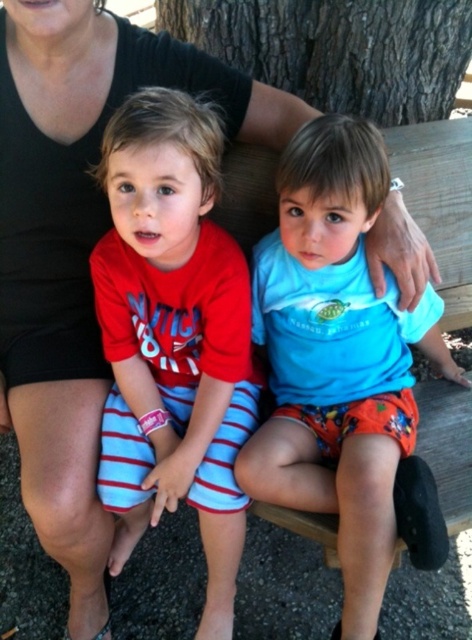
Can you confirm if blue matte shirt at center is positioned to the left of brown rough bark at upper center?

Incorrect, blue matte shirt at center is not on the left side of brown rough bark at upper center.

Can you confirm if blue matte shirt at center is wider than brown rough bark at upper center?

No.

This screenshot has height=640, width=472. In order to click on blue matte shirt at center in this screenshot , I will do `click(337, 356)`.

Is red striped shorts at center wider than blue matte shirt at center?

No.

Image resolution: width=472 pixels, height=640 pixels. Describe the element at coordinates (173, 337) in the screenshot. I see `red striped shorts at center` at that location.

What do you see at coordinates (173, 337) in the screenshot? I see `red striped shorts at center` at bounding box center [173, 337].

Find the location of `red striped shorts at center`. red striped shorts at center is located at coordinates (173, 337).

Does red striped shorts at center have a greater height compared to brown rough bark at upper center?

Correct, red striped shorts at center is much taller as brown rough bark at upper center.

Which is behind, point (175, 202) or point (270, 45)?

Point (270, 45)

This screenshot has height=640, width=472. I want to click on red striped shorts at center, so click(173, 337).